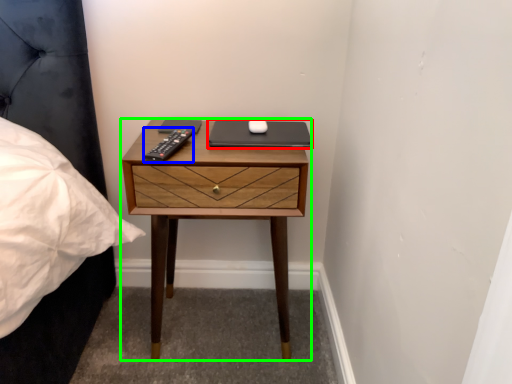
Question: Which is farther away from laptop (highlighted by a red box)? remote (highlighted by a blue box) or nightstand (highlighted by a green box)?

Choices:
 (A) remote
 (B) nightstand

Answer: (B)